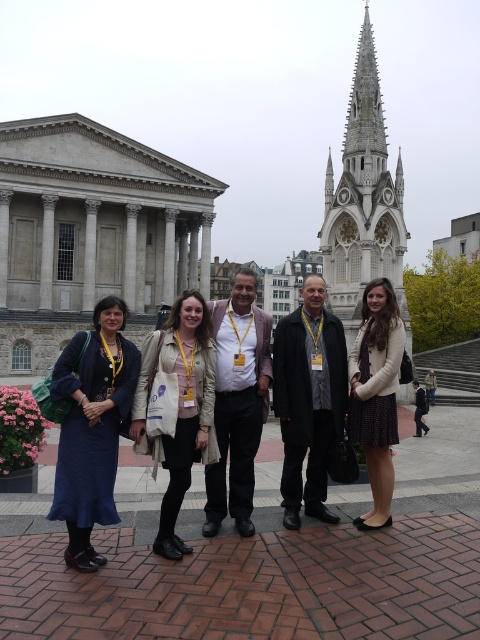
You are a photographer trying to capture a group photo of the matte beige coat at center and the matte white coat at center. Since the two coats are of different lengths, which coat should you position closer to the camera to ensure both appear equally tall in the photo?

The matte beige coat at center is shorter than the matte white coat at center. To make them appear equally tall in the photo, position the matte beige coat at center closer to the camera so that its smaller size is compensated by its proximity, balancing their apparent heights.

Looking at the group of people in front of the historic building, which coat is positioned to the left between the matte beige coat at center and the matte white coat at center?

The matte beige coat at center is positioned to the left of the matte white coat at center.

You are standing in the plaza and want to walk towards the two points marked in the image. Which point, point (156, 336) or point (383, 284), should you head towards if you want to reach the one that is closer to you?

Point (156, 336) is closer to the viewer, so you should head towards point (156, 336).